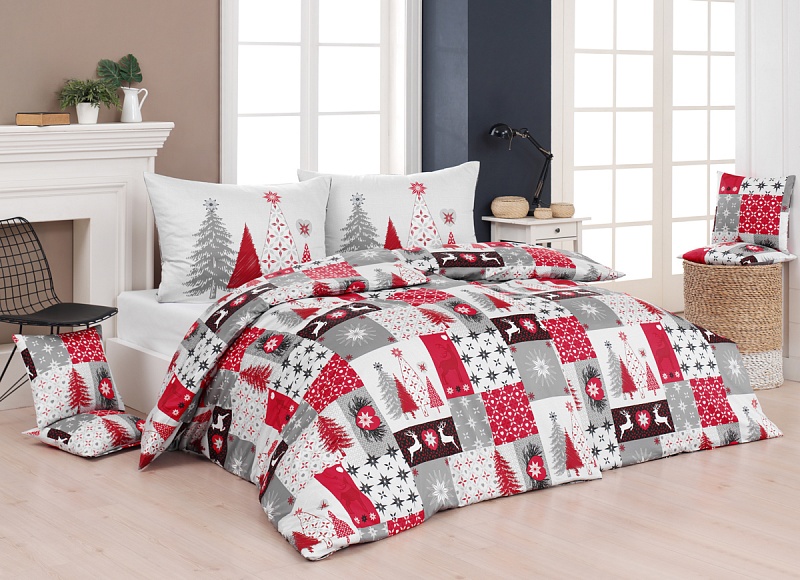
Locate an element on the screen. This screenshot has width=800, height=580. place to sit is located at coordinates (66, 316).